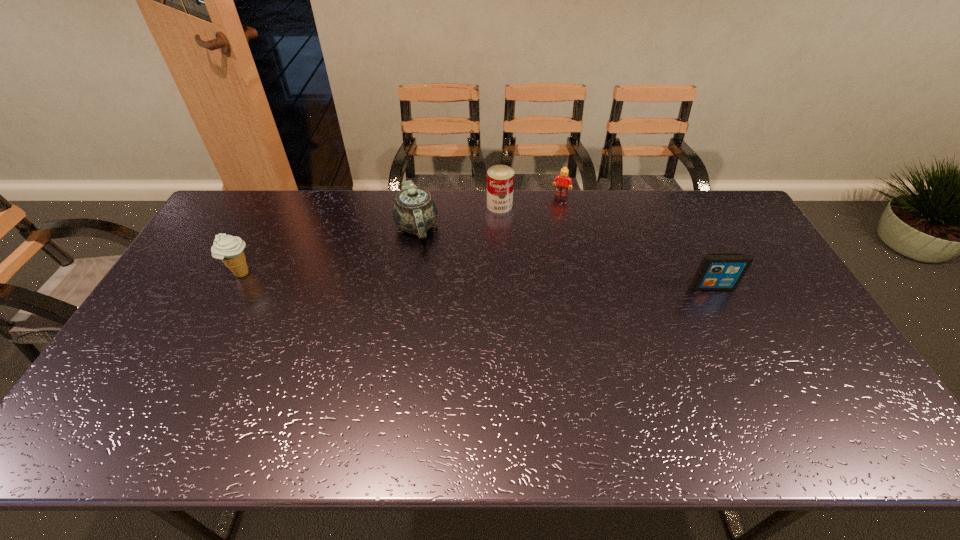
The height and width of the screenshot is (540, 960). I want to click on free space between the third object from right to left and the second object from left to right, so [x=458, y=216].

This screenshot has width=960, height=540. I want to click on free point between the iPod and the Lego, so click(x=636, y=241).

Locate an element on the screen. vacant space that's between the can and the icecream is located at coordinates (371, 240).

Where is `free spot between the can and the Lego`? free spot between the can and the Lego is located at coordinates (530, 200).

Locate an element on the screen. The height and width of the screenshot is (540, 960). free point between the fourth object from left to right and the iPod is located at coordinates (636, 241).

Where is `free space that is in between the iPod and the Lego`? free space that is in between the iPod and the Lego is located at coordinates (636, 241).

Image resolution: width=960 pixels, height=540 pixels. Identify the location of the second closest object to the icecream. (500, 178).

The image size is (960, 540). Identify the location of object that ranks as the fourth closest to the chinaware. (717, 271).